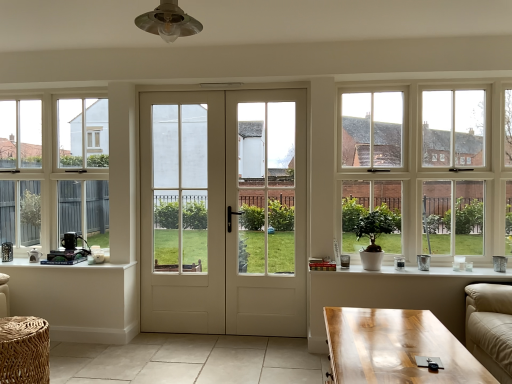
Locate an element on the screen. This screenshot has width=512, height=384. vacant space in front of white glass door at center, which is counted as the 1th screen door, starting from the left is located at coordinates (170, 352).